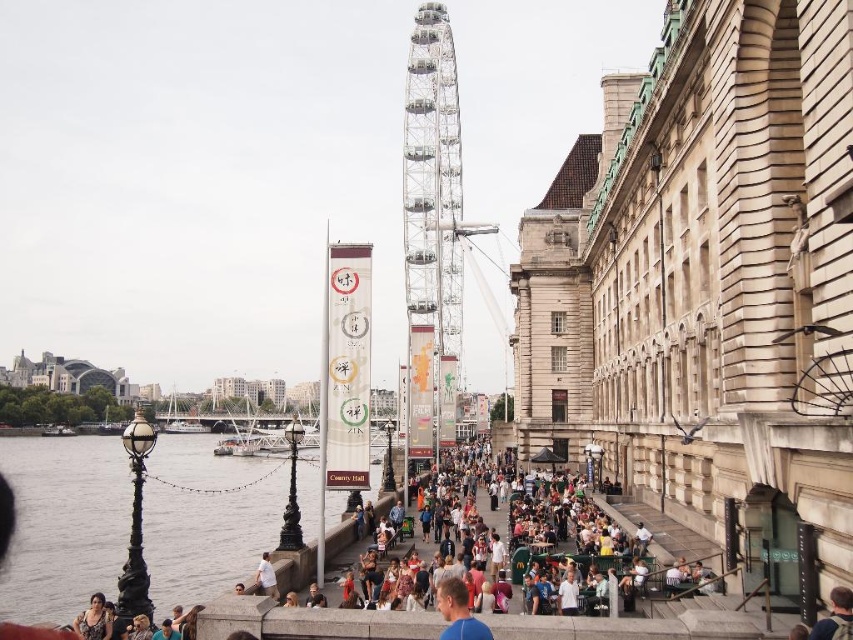
Is white metallic ferris wheel at center further to camera compared to white fabric shirt at lower center?

Yes, white metallic ferris wheel at center is behind white fabric shirt at lower center.

Can you confirm if white metallic ferris wheel at center is wider than white fabric shirt at lower center?

Indeed, white metallic ferris wheel at center has a greater width compared to white fabric shirt at lower center.

Between point (422, 237) and point (264, 580), which one is positioned behind?

Positioned behind is point (422, 237).

Where is `white metallic ferris wheel at center`? Image resolution: width=853 pixels, height=640 pixels. white metallic ferris wheel at center is located at coordinates [x=432, y=182].

Is point (68, 440) closer to camera compared to point (409, 60)?

No, it is behind (409, 60).

Which is below, smooth gray water at lower left or white metallic ferris wheel at center?

smooth gray water at lower left is below.

Where is `smooth gray water at lower left`? smooth gray water at lower left is located at coordinates (62, 524).

Is matte black dress at lower left to the left of white fabric shirt at lower center from the viewer's perspective?

Indeed, matte black dress at lower left is positioned on the left side of white fabric shirt at lower center.

Image resolution: width=853 pixels, height=640 pixels. Identify the location of matte black dress at lower left. (93, 620).

Image resolution: width=853 pixels, height=640 pixels. In order to click on matte black dress at lower left in this screenshot , I will do `click(93, 620)`.